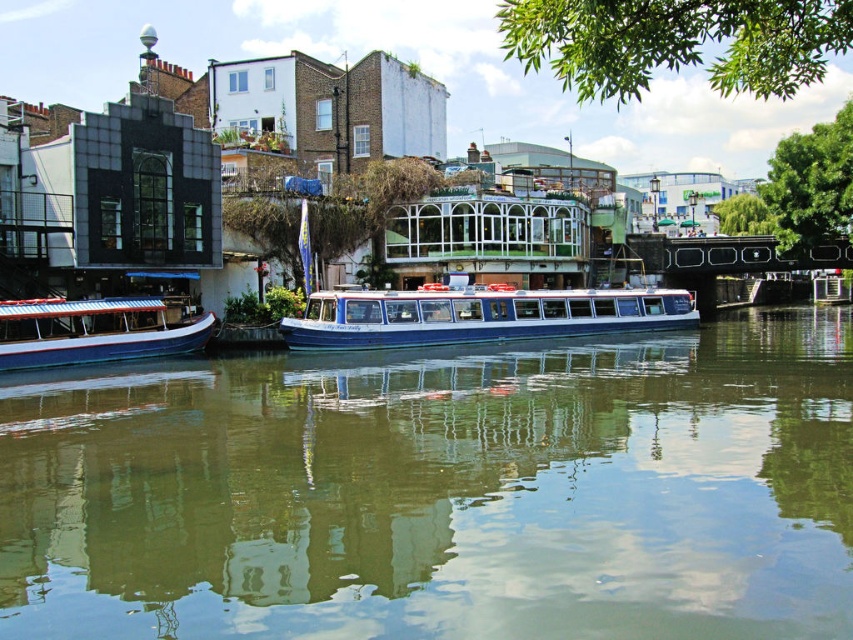
Question: Which point is closer to the camera taking this photo?

Choices:
 (A) (344, 577)
 (B) (525, 337)
 (C) (56, 326)

Answer: (A)

Question: Is green reflective water at center below blue polished wood boat at left?

Choices:
 (A) no
 (B) yes

Answer: (B)

Question: Which object is positioned closest to the blue polished wood boat at left?

Choices:
 (A) blue polished wood boat at center
 (B) green reflective water at center

Answer: (B)

Question: Observing the image, what is the correct spatial positioning of green reflective water at center in reference to blue polished wood boat at left?

Choices:
 (A) right
 (B) left

Answer: (A)

Question: Which of the following is the farthest from the observer?

Choices:
 (A) (537, 390)
 (B) (491, 284)

Answer: (B)

Question: Is blue polished wood boat at center further to the viewer compared to blue polished wood boat at left?

Choices:
 (A) yes
 (B) no

Answer: (A)